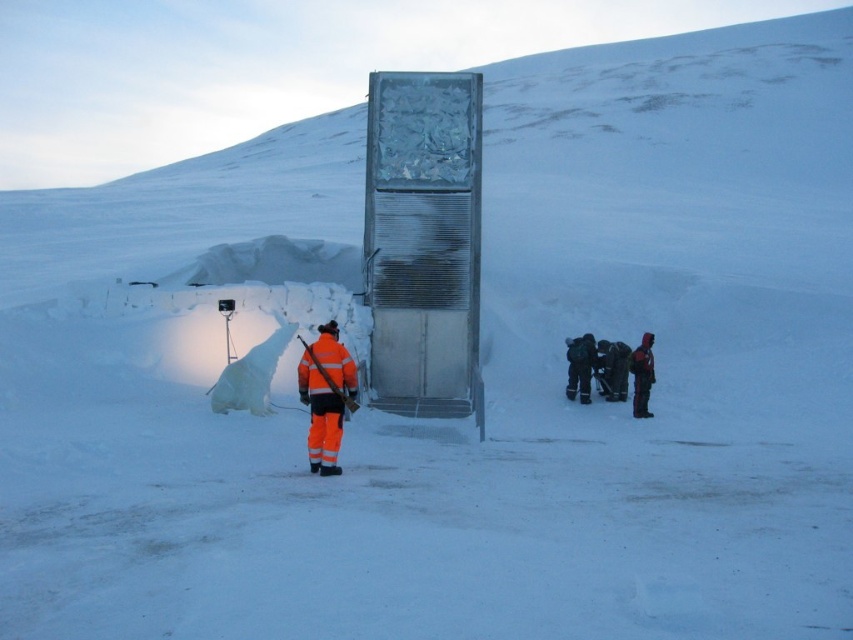
From the picture: You are a photographer trying to capture a clear shot of both the dark gray fabric jacket at lower center and the dark red fabric jacket at lower right. Since you want both subjects to be in focus, you need to know which jacket is closer to you. Can you tell me which one is nearer?

The dark gray fabric jacket at lower center is closer to you than the dark red fabric jacket at lower right, so you should adjust your focus accordingly to ensure both are in clear view.

You are a delivery person trying to locate the vault in the snowy landscape. You see the orange reflective safety vest at center and the orange reflective jacket at lower right. Which one is positioned higher up in the image?

The orange reflective safety vest at center is positioned higher up in the image than the orange reflective jacket at lower right.